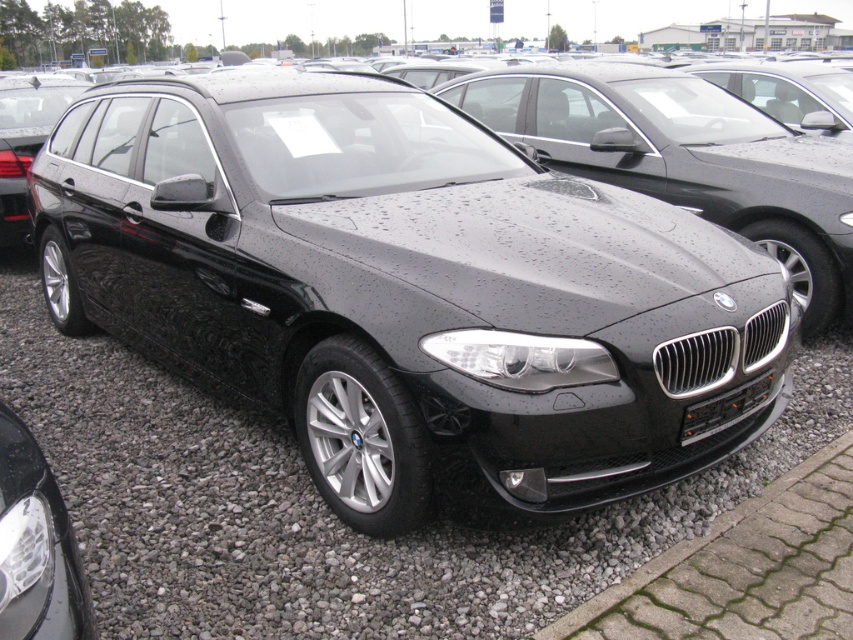
You are a car salesman who needs to direct a customer to the license plate of the BMW station wagon. Based on the scene, where is the black metallic license plate at center located relative to the gray gravel at center?

The black metallic license plate at center is on the right side of the gray gravel at center.